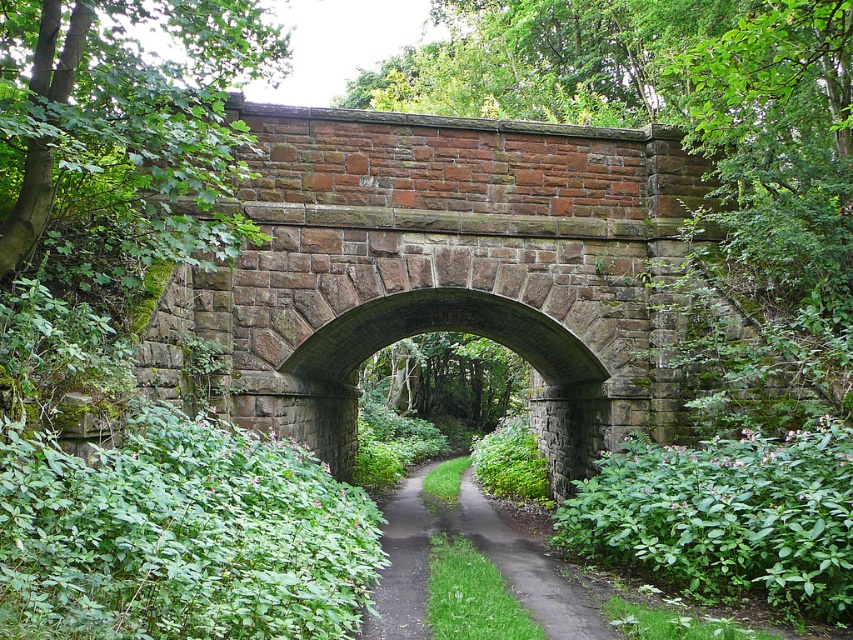
Does reddish-brown stone archway at center have a smaller size compared to dull gray asphalt path at center?

Incorrect, reddish-brown stone archway at center is not smaller in size than dull gray asphalt path at center.

Which is in front, point (439, 301) or point (469, 506)?

Point (439, 301) is in front.

At what (x,y) coordinates should I click in order to perform the action: click on reddish-brown stone archway at center. Please return your answer as a coordinate pair (x, y). This screenshot has height=640, width=853. Looking at the image, I should click on (444, 272).

Between point (141, 451) and point (410, 621), which one is positioned in front?

Point (141, 451)

This screenshot has width=853, height=640. I want to click on green leafy bush at lower left, so click(x=180, y=536).

Which is below, reddish-brown stone archway at center or dirt path at center?

dirt path at center

Who is positioned more to the right, reddish-brown stone archway at center or dirt path at center?

Positioned to the right is reddish-brown stone archway at center.

Who is more distant from viewer, (279, 426) or (393, 600)?

Point (279, 426)

Where is `reddish-brown stone archway at center`? The height and width of the screenshot is (640, 853). reddish-brown stone archway at center is located at coordinates (444, 272).